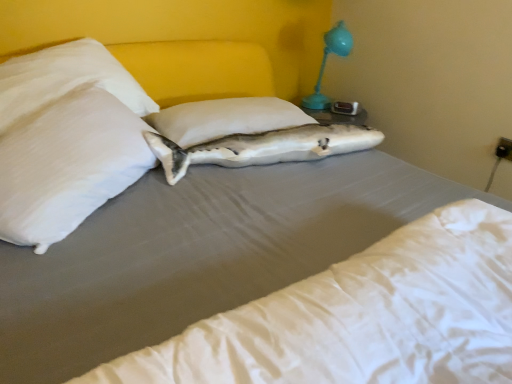
Question: From the image's perspective, relative to white satin pillow at upper left, arranged as the 2th pillow when viewed from the right, is white smooth mattress at center above or below?

Choices:
 (A) below
 (B) above

Answer: (A)

Question: Considering the relative positions of white smooth mattress at center and white satin pillow at upper left, arranged as the 2th pillow when viewed from the right, in the image provided, is white smooth mattress at center to the left or to the right of white satin pillow at upper left, arranged as the 2th pillow when viewed from the right,?

Choices:
 (A) left
 (B) right

Answer: (B)

Question: Considering the real-world distances, which object is closest to the white smooth mattress at center?

Choices:
 (A) matte blue plastic lamp at upper right
 (B) white matte fish at center
 (C) white fabric pillow at center, the 2th pillow from the left
 (D) white satin pillow at upper left, arranged as the 2th pillow when viewed from the right

Answer: (D)

Question: Which object is the farthest from the white smooth mattress at center?

Choices:
 (A) white fabric pillow at center, the 2th pillow from the left
 (B) matte blue plastic lamp at upper right
 (C) white matte fish at center
 (D) white satin pillow at upper left, arranged as the 1th pillow when viewed from the left

Answer: (B)